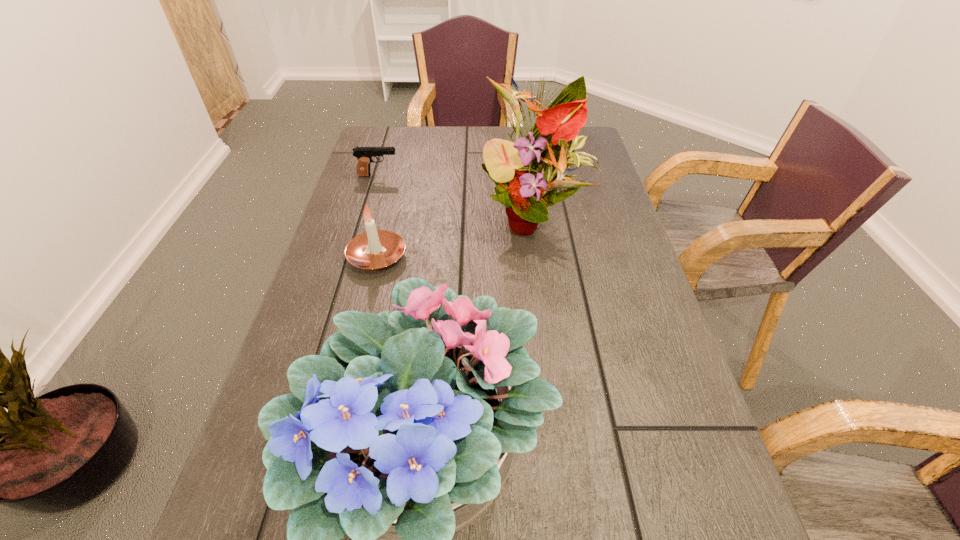
At what (x,y) coordinates should I click in order to perform the action: click on the farther bouquet. Please return your answer as a coordinate pair (x, y). The height and width of the screenshot is (540, 960). Looking at the image, I should click on (523, 171).

This screenshot has height=540, width=960. I want to click on the third tallest object, so click(374, 249).

Where is `the shortest object`? The height and width of the screenshot is (540, 960). the shortest object is located at coordinates (364, 155).

I want to click on the farthest object, so click(x=364, y=155).

Where is `vacant region located on the front-facing side of the farther bouquet`? This screenshot has width=960, height=540. vacant region located on the front-facing side of the farther bouquet is located at coordinates (546, 323).

Identify the location of vacant space located 0.400m on the right of the third tallest object. (572, 257).

Find the location of a particular element. Image resolution: width=960 pixels, height=540 pixels. vacant region located 0.240m at the barrel of the pistol is located at coordinates coord(479,176).

At what (x,y) coordinates should I click in order to perform the action: click on candle present at the left edge. Please return your answer as a coordinate pair (x, y). The width and height of the screenshot is (960, 540). Looking at the image, I should click on (374, 249).

At what (x,y) coordinates should I click in order to perform the action: click on pistol that is positioned at the left edge. Please return your answer as a coordinate pair (x, y). Image resolution: width=960 pixels, height=540 pixels. Looking at the image, I should click on (x=364, y=155).

At what (x,y) coordinates should I click in order to perform the action: click on object that is at the right edge. Please return your answer as a coordinate pair (x, y). Looking at the image, I should click on (523, 171).